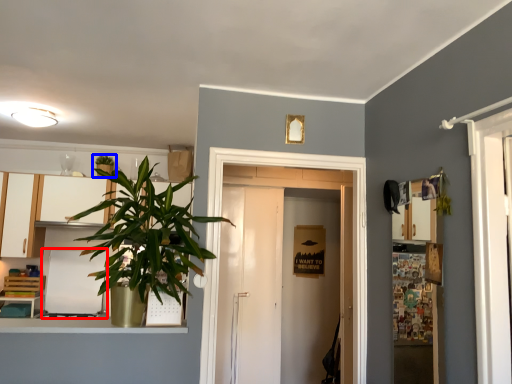
Question: Among these objects, which one is nearest to the camera, appliance (highlighted by a red box) or houseplant (highlighted by a blue box)?

Choices:
 (A) appliance
 (B) houseplant

Answer: (A)